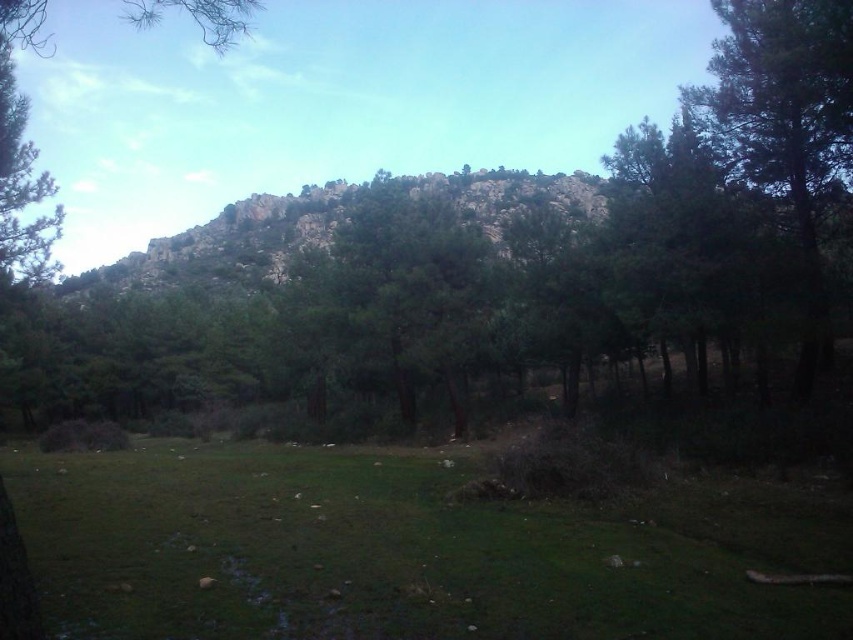
Who is shorter, green grassy field at lower left or green textured tree at center?

green grassy field at lower left

Is point (386, 630) closer to viewer compared to point (320, 323)?

That is True.

You are a GUI agent. You are given a task and a screenshot of the screen. Output one action in this format:
    pyautogui.click(x=<x>, y=<y>)
    Task: Click on the green grassy field at lower left
    This screenshot has height=640, width=853.
    Given the screenshot: What is the action you would take?
    pyautogui.click(x=386, y=554)